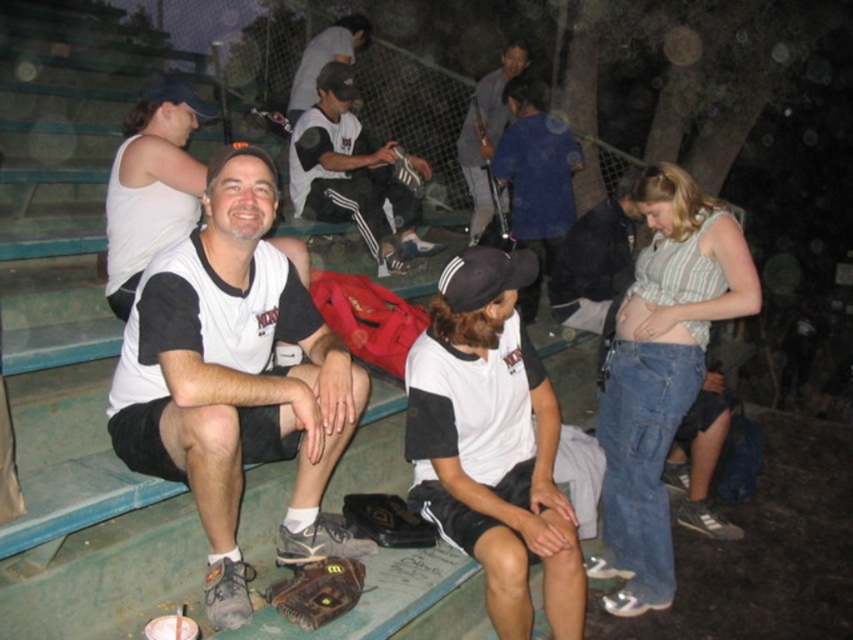
In the nighttime scene at the sports field, there are two people sitting on the bleachers wearing white and black shirts with KNOX printed on them. A baseball glove is near one of them. There is also a point marked at coordinates (535, 177). What object is located at that point?

The point at (535, 177) marks the blue matte shirt at center.